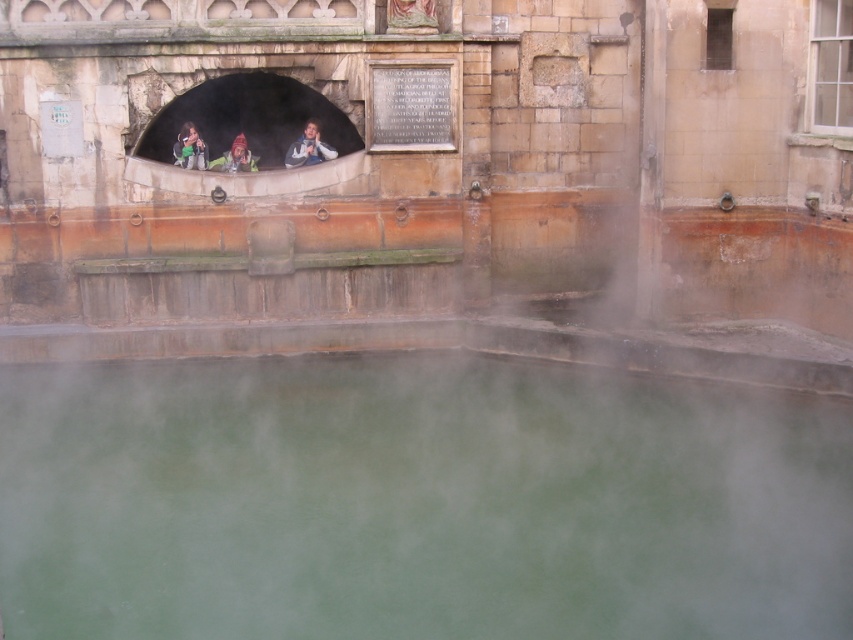
Question: Does green fabric jacket at upper center have a greater width compared to reddish-brown fur hat at center?

Choices:
 (A) yes
 (B) no

Answer: (B)

Question: Which of these objects is positioned farthest from the green opaque water at center?

Choices:
 (A) green fabric jacket at upper center
 (B) light brown leather jacket at upper center
 (C) reddish-brown fur hat at center

Answer: (C)

Question: Is green fabric jacket at upper center above reddish-brown fur hat at center?

Choices:
 (A) no
 (B) yes

Answer: (B)

Question: Is light brown leather jacket at upper center further to camera compared to green fabric jacket at upper center?

Choices:
 (A) yes
 (B) no

Answer: (A)

Question: Among these objects, which one is farthest from the camera?

Choices:
 (A) green fabric jacket at upper center
 (B) reddish-brown fur hat at center

Answer: (B)

Question: Which is farther from the reddish-brown fur hat at center?

Choices:
 (A) green fabric jacket at upper center
 (B) light brown leather jacket at upper center

Answer: (B)